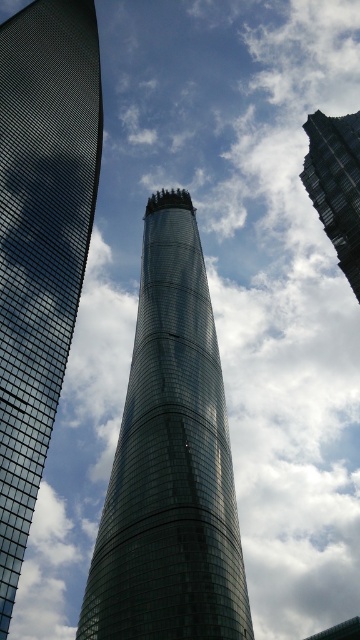
Which is above, shiny glass skyscraper at left or glassy skyscraper at upper right?

shiny glass skyscraper at left

Is point (96, 93) behind point (354, 285)?

Yes, point (96, 93) is behind point (354, 285).

Between point (27, 125) and point (327, 188), which one is positioned behind?

The point (327, 188) is behind.

Find the location of a particular element. This screenshot has height=640, width=360. shiny glass skyscraper at left is located at coordinates (41, 241).

Which is below, shiny glass tower at center or shiny glass skyscraper at left?

shiny glass tower at center

Is shiny glass tower at center bigger than shiny glass skyscraper at left?

No.

Who is more distant from viewer, (x=209, y=552) or (x=95, y=52)?

The point (x=95, y=52) is behind.

At what (x,y) coordinates should I click in order to perform the action: click on shiny glass tower at center. Please return your answer as a coordinate pair (x, y). The height and width of the screenshot is (640, 360). Looking at the image, I should click on (169, 461).

Who is more distant from viewer, (145,438) or (358,301)?

Positioned behind is point (358,301).

Is point (241, 627) positioned behind point (348, 204)?

No, it is not.

Find the location of a particular element. The width and height of the screenshot is (360, 640). shiny glass tower at center is located at coordinates [x=169, y=461].

Where is `shiny glass tower at center`? This screenshot has width=360, height=640. shiny glass tower at center is located at coordinates (x=169, y=461).